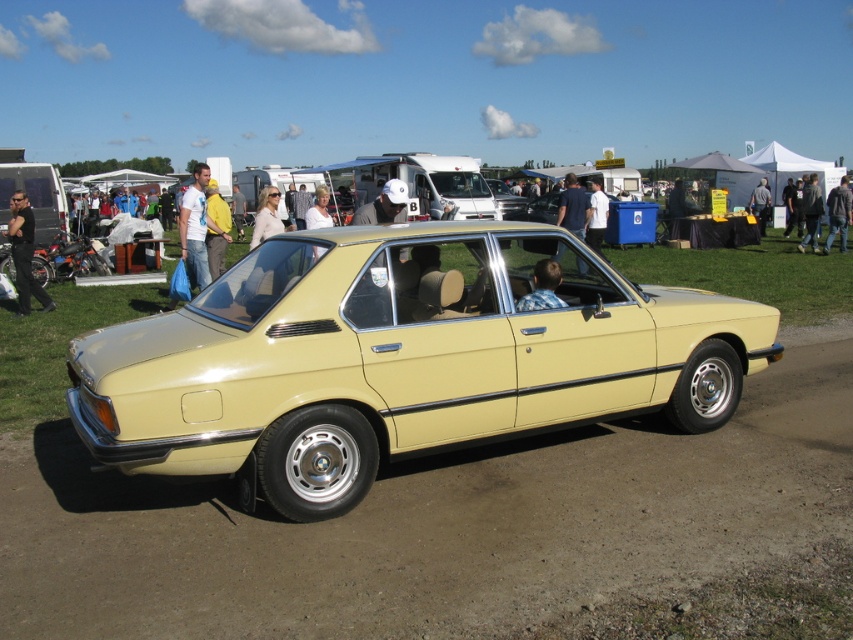
Question: Among these points, which one is farthest from the camera?

Choices:
 (A) (547, 284)
 (B) (189, 186)
 (C) (97, 378)
 (D) (575, 195)

Answer: (B)

Question: Is matte yellow car at center to the right of black leather jacket at left from the viewer's perspective?

Choices:
 (A) yes
 (B) no

Answer: (A)

Question: Which of the following is the closest to the observer?

Choices:
 (A) yellow matte car at center
 (B) blue plaid shirt at center
 (C) yellow fabric jacket at center
 (D) dark gray jacket at center

Answer: (A)

Question: Is matte yellow car at center above blue plaid shirt at center?

Choices:
 (A) no
 (B) yes

Answer: (A)

Question: Which object is the farthest from the gray fabric jacket at upper center?

Choices:
 (A) white shirt at upper center
 (B) yellow fabric jacket at center
 (C) dark gray jacket at center
 (D) matte yellow car at center

Answer: (D)

Question: Does black leather jacket at left have a lesser width compared to denim jacket at lower right?

Choices:
 (A) no
 (B) yes

Answer: (B)